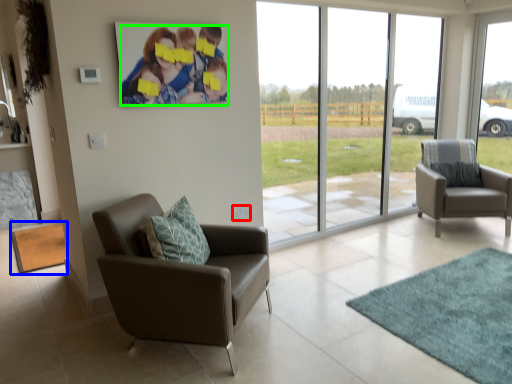
Question: Based on their relative distances, which object is farther from power outlet (highlighted by a red box)? Choose from mat (highlighted by a blue box) and couple (highlighted by a green box).

Choices:
 (A) mat
 (B) couple

Answer: (A)